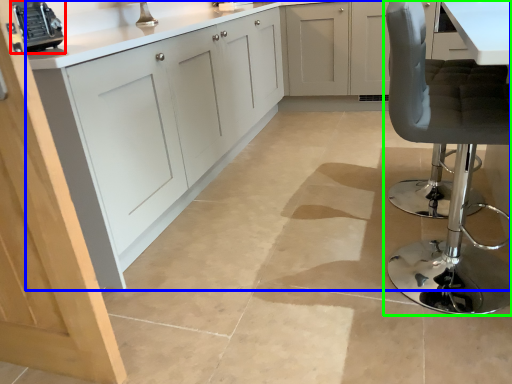
Question: Which object is positioned farthest from appliance (highlighted by a red box)? Select from cabinetry (highlighted by a blue box) and chair (highlighted by a green box).

Choices:
 (A) cabinetry
 (B) chair

Answer: (B)